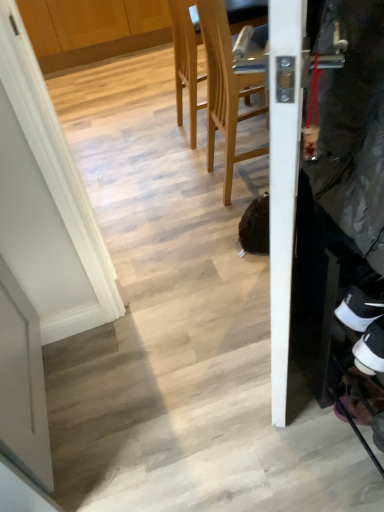
Question: Which direction should I rotate to face light wood chair at upper center, marked as the 1th chair in a back-to-front arrangement, — up or down?

Choices:
 (A) up
 (B) down

Answer: (A)

Question: Are light wood chair at upper center, marked as the 1th chair in a back-to-front arrangement, and wooden at center, acting as the first chair starting from the front, located far from each other?

Choices:
 (A) yes
 (B) no

Answer: (B)

Question: Can you confirm if light wood chair at upper center, marked as the 1th chair in a back-to-front arrangement, is smaller than wooden at center, the 2th chair when ordered from back to front?

Choices:
 (A) no
 (B) yes

Answer: (A)

Question: Can you confirm if light wood chair at upper center, which is the second chair from front to back, is positioned to the right of wooden at center, the 2th chair when ordered from back to front?

Choices:
 (A) no
 (B) yes

Answer: (A)

Question: Is light wood chair at upper center, which is the second chair from front to back, oriented away from wooden at center, acting as the first chair starting from the front?

Choices:
 (A) yes
 (B) no

Answer: (B)

Question: Can you confirm if light wood chair at upper center, which is the second chair from front to back, is wider than wooden at center, acting as the first chair starting from the front?

Choices:
 (A) yes
 (B) no

Answer: (A)

Question: Could wooden at center, acting as the first chair starting from the front, be considered to be inside light wood chair at upper center, marked as the 1th chair in a back-to-front arrangement?

Choices:
 (A) yes
 (B) no

Answer: (B)

Question: Is white suede sneaker at lower right turned away from light wood chair at upper center, which is the second chair from front to back?

Choices:
 (A) no
 (B) yes

Answer: (A)

Question: Considering the relative positions of white suede sneaker at lower right and light wood chair at upper center, which is the second chair from front to back, in the image provided, is white suede sneaker at lower right in front of light wood chair at upper center, which is the second chair from front to back,?

Choices:
 (A) no
 (B) yes

Answer: (B)

Question: From a real-world perspective, is white suede sneaker at lower right beneath light wood chair at upper center, marked as the 1th chair in a back-to-front arrangement?

Choices:
 (A) yes
 (B) no

Answer: (B)

Question: Would you consider white suede sneaker at lower right to be distant from light wood chair at upper center, marked as the 1th chair in a back-to-front arrangement?

Choices:
 (A) no
 (B) yes

Answer: (B)

Question: Is white suede sneaker at lower right to the left of light wood chair at upper center, which is the second chair from front to back, from the viewer's perspective?

Choices:
 (A) no
 (B) yes

Answer: (A)

Question: Is light wood chair at upper center, which is the second chair from front to back, a part of white suede sneaker at lower right?

Choices:
 (A) yes
 (B) no

Answer: (B)

Question: Does white suede sneaker at lower right have a lesser height compared to wooden at center, the 2th chair when ordered from back to front?

Choices:
 (A) yes
 (B) no

Answer: (A)